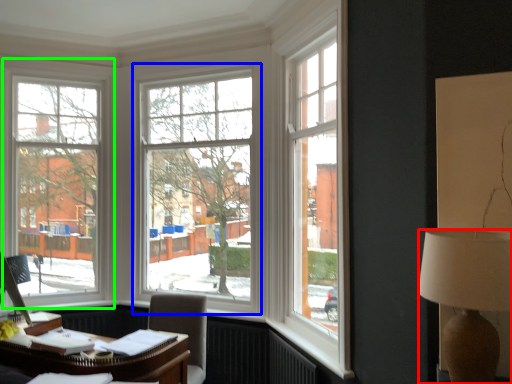
Question: Considering the real-world distances, which object is closest to lamp (highlighted by a red box)? window (highlighted by a blue box) or window (highlighted by a green box).

Choices:
 (A) window
 (B) window

Answer: (A)